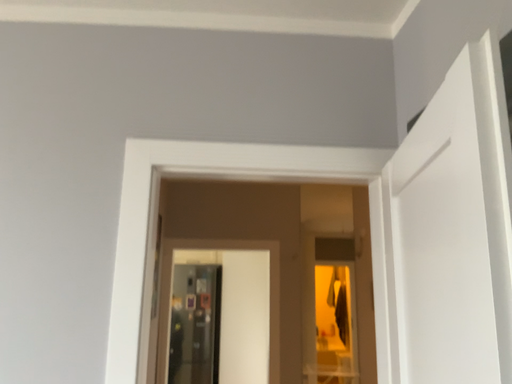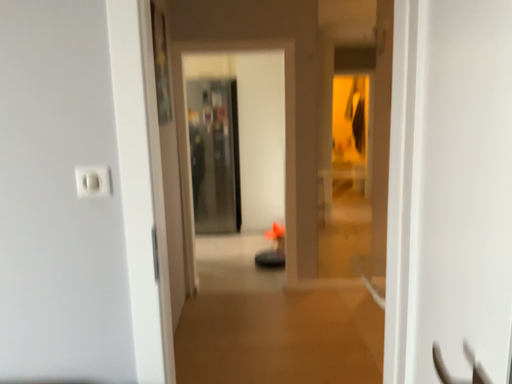
Question: Which way did the camera rotate in the video?

Choices:
 (A) rotated upward
 (B) rotated downward

Answer: (B)